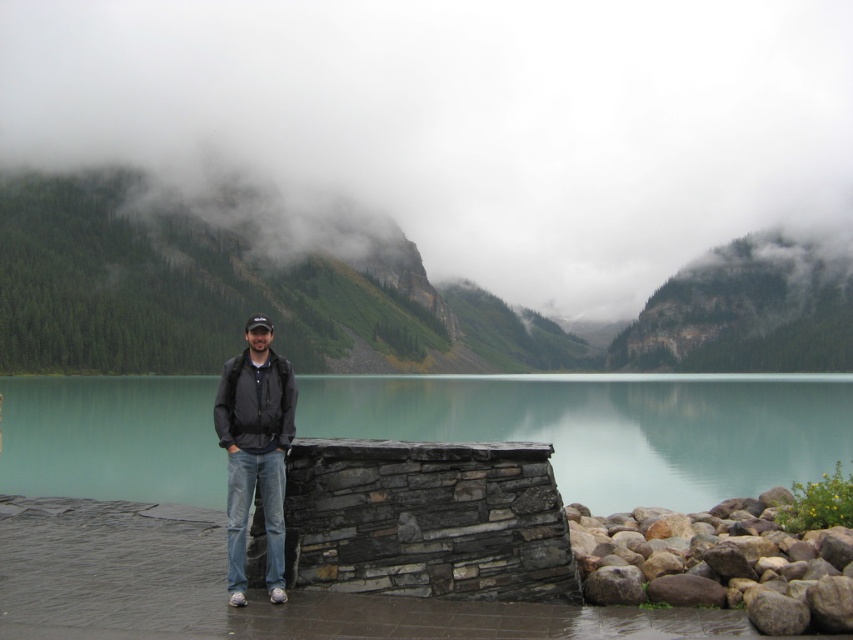
Between teal stone water at center and dark gray jacket at center, which one appears on the left side from the viewer's perspective?

dark gray jacket at center

Is point (312, 435) farther from viewer compared to point (238, 461)?

Yes, it is.

Where is `teal stone water at center`? The width and height of the screenshot is (853, 640). teal stone water at center is located at coordinates (611, 428).

Describe the element at coordinates (361, 294) in the screenshot. Image resolution: width=853 pixels, height=640 pixels. I see `green forested mountain at upper center` at that location.

Can you confirm if green forested mountain at upper center is thinner than brown rough rock at lower right?

In fact, green forested mountain at upper center might be wider than brown rough rock at lower right.

Does point (140, 342) come closer to viewer compared to point (665, 518)?

No, it is behind (665, 518).

Locate an element on the screen. This screenshot has height=640, width=853. green forested mountain at upper center is located at coordinates (361, 294).

Between point (462, 6) and point (552, 420), which one is positioned behind?

Positioned behind is point (462, 6).

Is foggy misty mountain at upper center further to camera compared to teal stone water at center?

Yes.

Which is behind, point (486, 120) or point (149, 397)?

The point (486, 120) is more distant.

Where is `foggy misty mountain at upper center`? Image resolution: width=853 pixels, height=640 pixels. foggy misty mountain at upper center is located at coordinates (463, 120).